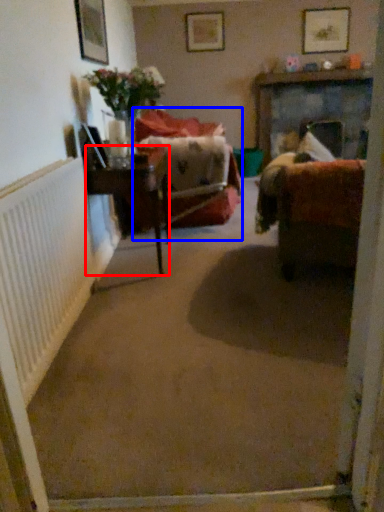
Question: Which point is further to the camera, table (highlighted by a red box) or chair (highlighted by a blue box)?

Choices:
 (A) table
 (B) chair

Answer: (B)